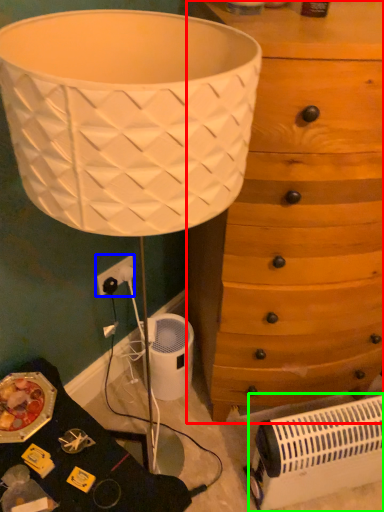
Question: Estimate the real-world distances between objects in this image. Which object is farther from chest of drawers (highlighted by a red box), electric outlet (highlighted by a blue box) or heater (highlighted by a green box)?

Choices:
 (A) electric outlet
 (B) heater

Answer: (A)